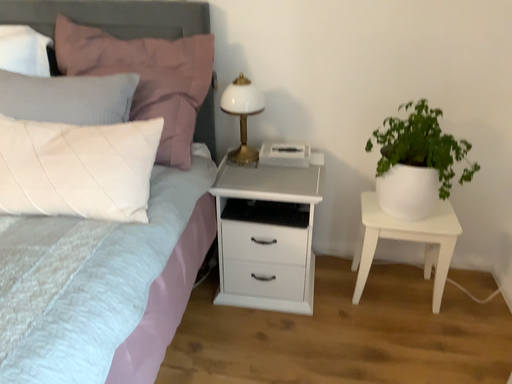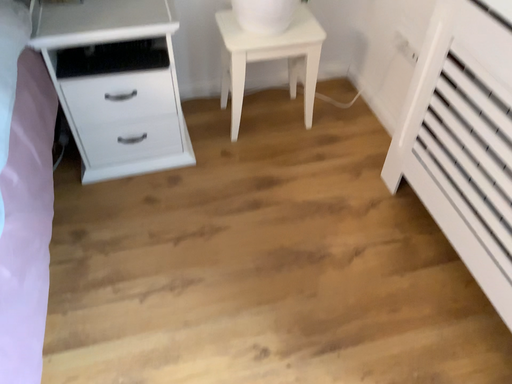
Question: Which way did the camera rotate in the video?

Choices:
 (A) rotated left
 (B) rotated right

Answer: (B)